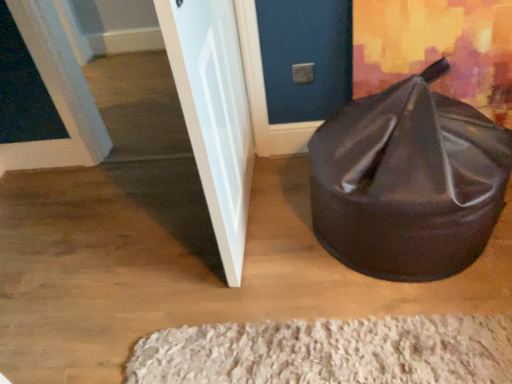
The width and height of the screenshot is (512, 384). What are the coordinates of `free space that is to the left of white shaggy rug at lower center` in the screenshot? It's located at (112, 298).